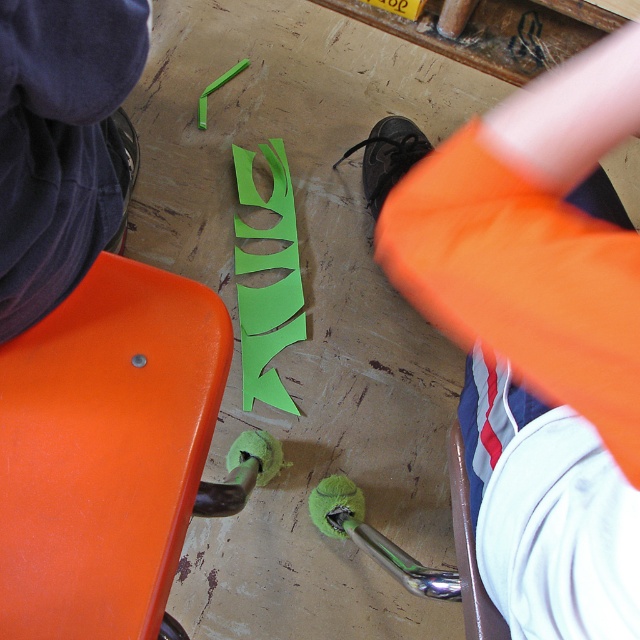
You are standing at the origin of the coordinate system in the classroom. You see two points marked on the floor at point (x=282, y=166) and point (x=472, y=621). Which point is closer to you?

Point (x=282, y=166) is behind point (x=472, y=621), so point (x=472, y=621) is closer to you.